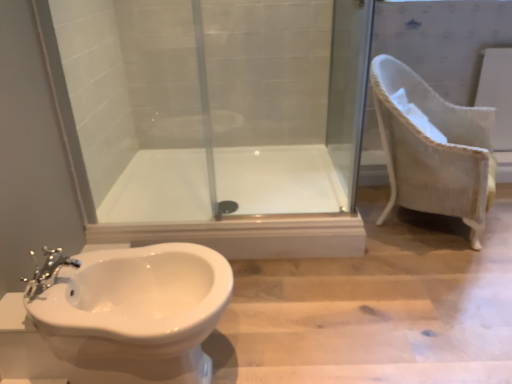
This screenshot has height=384, width=512. Find the location of `free space behind transparent glass screen door at center`. free space behind transparent glass screen door at center is located at coordinates (313, 157).